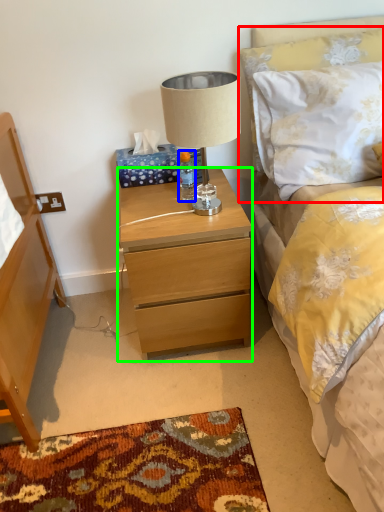
Question: Estimate the real-world distances between objects in this image. Which object is closer to pillow (highlighted by a red box), bottle (highlighted by a blue box) or nightstand (highlighted by a green box)?

Choices:
 (A) bottle
 (B) nightstand

Answer: (A)